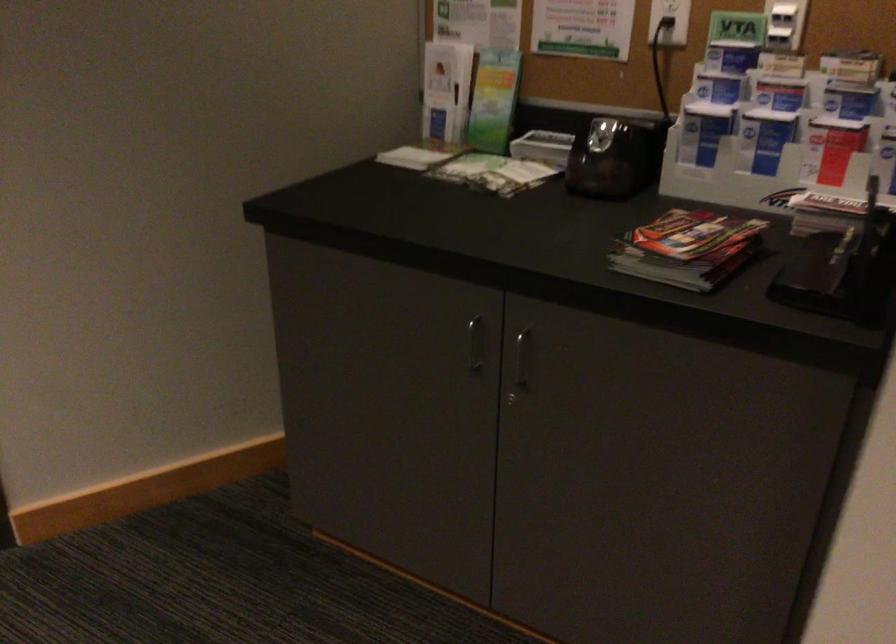
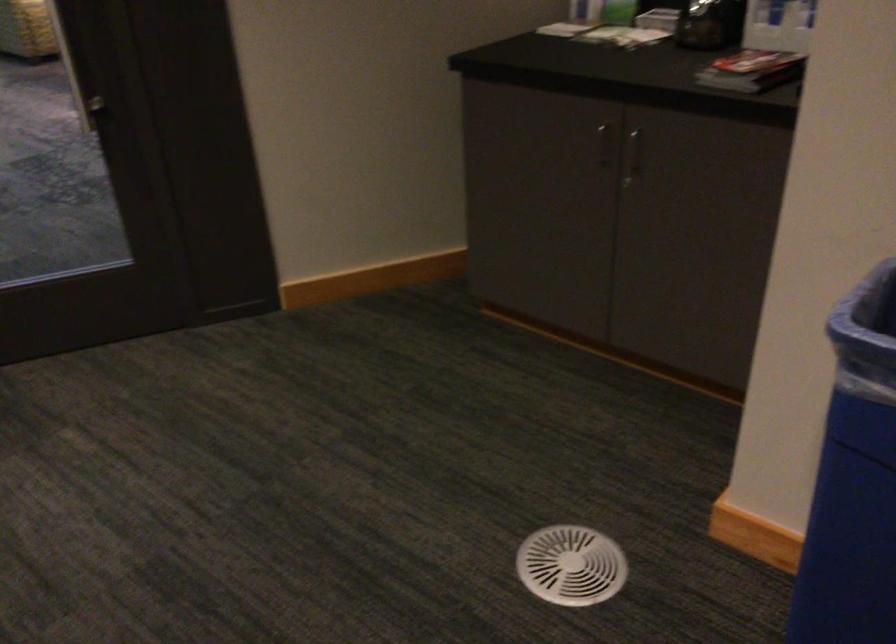
Question: Based on the continuous images, in which direction is the camera rotating? Reply with the corresponding letter.

Choices:
 (A) Left
 (B) Right
 (C) Up
 (D) Down

Answer: (A)